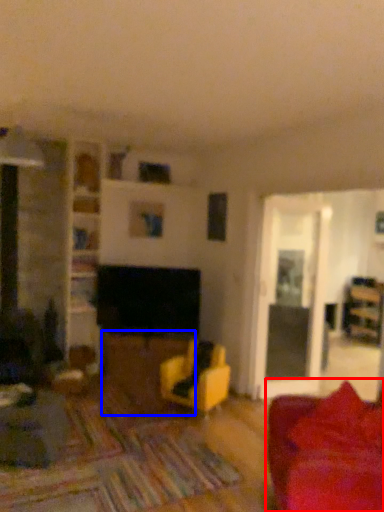
Question: Which object appears farthest to the camera in this image, studio couch (highlighted by a red box) or table (highlighted by a blue box)?

Choices:
 (A) studio couch
 (B) table

Answer: (B)